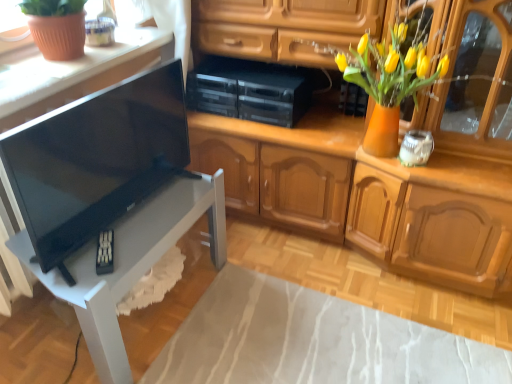
The image size is (512, 384). What are the coordinates of `matte black speaker at upper center, the 2th appliance viewed from the right` in the screenshot? It's located at (353, 99).

Measure the distance between point (19, 237) and camera.

Point (19, 237) is 4.23 feet away from camera.

In order to click on black plastic stereo at center, the third appliance positioned from the right in this screenshot , I will do `click(273, 96)`.

The image size is (512, 384). I want to click on black glossy tv at left, so click(96, 160).

Is white glossy table at lower left looking in the opposite direction of black glossy tv at left?

white glossy table at lower left does not have its back to black glossy tv at left.

In the image, there is a black glossy tv at left. Identify the location of table below it (from a real-world perspective). (131, 262).

Is white glossy table at lower left wider than black glossy tv at left?

Yes.

Does white glossy table at lower left lie behind white glass jar at upper right, the first appliance positioned from the right?

No.

Between white glossy table at lower left and white glass jar at upper right, positioned as the 3th appliance in left-to-right order, which one has larger size?

white glossy table at lower left is bigger.

From the image's perspective, relative to matte white countertop at upper left, is black plastic stereo at center, the first appliance from the left, above or below?

black plastic stereo at center, the first appliance from the left, is below matte white countertop at upper left.

Where is `countertop positioned vertically above the black plastic stereo at center, the third appliance positioned from the right (from a real-world perspective)`? The height and width of the screenshot is (384, 512). countertop positioned vertically above the black plastic stereo at center, the third appliance positioned from the right (from a real-world perspective) is located at coordinates 70,68.

Visually, is black plastic stereo at center, the third appliance positioned from the right, positioned to the left or to the right of matte white countertop at upper left?

black plastic stereo at center, the third appliance positioned from the right, is to the right of matte white countertop at upper left.

Considering their positions, is black plastic stereo at center, the first appliance from the left, located in front of or behind matte white countertop at upper left?

black plastic stereo at center, the first appliance from the left, is positioned farther from the viewer than matte white countertop at upper left.

The image size is (512, 384). In order to click on the 2nd appliance above when counting from the white glass jar at upper right, positioned as the 3th appliance in left-to-right order (from the image's perspective) in this screenshot , I will do `click(353, 99)`.

From the image's perspective, relative to matte black speaker at upper center, which is the 2th appliance from left to right, is white glass jar at upper right, positioned as the 3th appliance in left-to-right order, above or below?

Based on their image positions, white glass jar at upper right, positioned as the 3th appliance in left-to-right order, is located beneath matte black speaker at upper center, which is the 2th appliance from left to right.

In the scene shown: Looking at their sizes, would you say white glass jar at upper right, the first appliance positioned from the right, is wider or thinner than matte black speaker at upper center, which is the 2th appliance from left to right?

Clearly, white glass jar at upper right, the first appliance positioned from the right, has more width compared to matte black speaker at upper center, which is the 2th appliance from left to right.

From the image's perspective, is matte white countertop at upper left located above or below black glossy tv at left?

Based on their image positions, matte white countertop at upper left is located above black glossy tv at left.

Considering the sizes of objects matte white countertop at upper left and black glossy tv at left in the image provided, who is bigger, matte white countertop at upper left or black glossy tv at left?

With larger size is black glossy tv at left.

Considering the sizes of objects matte white countertop at upper left and black glossy tv at left in the image provided, who is wider, matte white countertop at upper left or black glossy tv at left?

matte white countertop at upper left.

Is matte black speaker at upper center, which is the 2th appliance from left to right, positioned far away from black glossy tv at left?

Yes, matte black speaker at upper center, which is the 2th appliance from left to right, is far from black glossy tv at left.

Could you tell me if matte black speaker at upper center, which is the 2th appliance from left to right, is facing black glossy tv at left?

No, matte black speaker at upper center, which is the 2th appliance from left to right, is not aimed at black glossy tv at left.

From the image's perspective, is matte black speaker at upper center, the 2th appliance viewed from the right, under black glossy tv at left?

No, from the image's perspective, matte black speaker at upper center, the 2th appliance viewed from the right, is not beneath black glossy tv at left.

Which of these two, matte black speaker at upper center, which is the 2th appliance from left to right, or black glossy tv at left, is smaller?

Smaller between the two is matte black speaker at upper center, which is the 2th appliance from left to right.

Looking at this image, does matte black speaker at upper center, the 2th appliance viewed from the right, appear on the right side of white glossy table at lower left?

Correct, you'll find matte black speaker at upper center, the 2th appliance viewed from the right, to the right of white glossy table at lower left.

From the image's perspective, is matte black speaker at upper center, the 2th appliance viewed from the right, above or below white glossy table at lower left?

matte black speaker at upper center, the 2th appliance viewed from the right, is above white glossy table at lower left.

Between matte black speaker at upper center, the 2th appliance viewed from the right, and white glossy table at lower left, which one has larger width?

With larger width is white glossy table at lower left.

Between matte black speaker at upper center, the 2th appliance viewed from the right, and white glossy table at lower left, which one has more height?

white glossy table at lower left is taller.

Locate an element on the screen. table behind the black glossy tv at left is located at coordinates (131, 262).

Find the location of `the 1st appliance above when counting from the white glossy table at lower left (from the image's perspective)`. the 1st appliance above when counting from the white glossy table at lower left (from the image's perspective) is located at coordinates (416, 148).

Considering their positions, is matte white countertop at upper left positioned further to white glossy table at lower left than black plastic stereo at center, the third appliance positioned from the right?

Based on the image, black plastic stereo at center, the third appliance positioned from the right, appears to be further to white glossy table at lower left.

Looking at this image, looking at the image, which one is located further to matte white countertop at upper left, white glass jar at upper right, positioned as the 3th appliance in left-to-right order, or matte black speaker at upper center, the 2th appliance viewed from the right?

white glass jar at upper right, positioned as the 3th appliance in left-to-right order, lies further to matte white countertop at upper left than the other object.

From the image, which object appears to be nearer to white glass jar at upper right, the first appliance positioned from the right, black plastic stereo at center, the third appliance positioned from the right, or matte black speaker at upper center, which is the 2th appliance from left to right?

matte black speaker at upper center, which is the 2th appliance from left to right, is closer to white glass jar at upper right, the first appliance positioned from the right.

Considering their positions, is white glass jar at upper right, the first appliance positioned from the right, positioned further to black glossy tv at left than matte white countertop at upper left?

The object further to black glossy tv at left is white glass jar at upper right, the first appliance positioned from the right.

Estimate the real-world distances between objects in this image. Which object is closer to matte black speaker at upper center, the 2th appliance viewed from the right, black glossy tv at left or black plastic stereo at center, the first appliance from the left?

black plastic stereo at center, the first appliance from the left, is positioned closer to the anchor matte black speaker at upper center, the 2th appliance viewed from the right.

Considering their positions, is matte white countertop at upper left positioned closer to black glossy tv at left than black plastic stereo at center, the third appliance positioned from the right?

matte white countertop at upper left is closer to black glossy tv at left.

Looking at the image, which one is located closer to matte black speaker at upper center, the 2th appliance viewed from the right, white glass jar at upper right, positioned as the 3th appliance in left-to-right order, or black plastic stereo at center, the first appliance from the left?

black plastic stereo at center, the first appliance from the left.

Estimate the real-world distances between objects in this image. Which object is further from white glossy table at lower left, matte white countertop at upper left or black glossy tv at left?

Among the two, matte white countertop at upper left is located further to white glossy table at lower left.

Locate an element on the screen. The width and height of the screenshot is (512, 384). table located between black glossy tv at left and black plastic stereo at center, the first appliance from the left, in the depth direction is located at coordinates (131, 262).

The image size is (512, 384). What are the coordinates of `appliance between black plastic stereo at center, the first appliance from the left, and white glass jar at upper right, the first appliance positioned from the right, in the horizontal direction` in the screenshot? It's located at (353, 99).

Identify the location of television situated between white glossy table at lower left and matte black speaker at upper center, the 2th appliance viewed from the right, from left to right. The height and width of the screenshot is (384, 512). (96, 160).

Find the location of a particular element. The height and width of the screenshot is (384, 512). table between matte white countertop at upper left and matte black speaker at upper center, which is the 2th appliance from left to right is located at coordinates (131, 262).